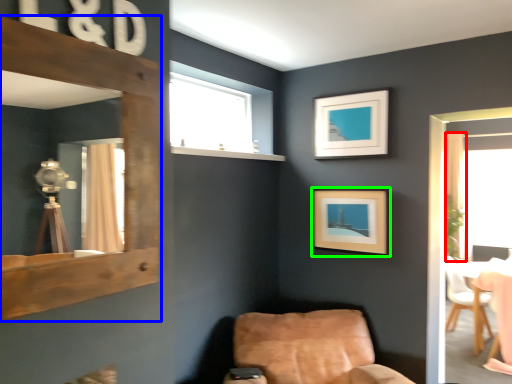
Question: Which object is positioned closest to curtain (highlighted by a red box)? Select from mirror (highlighted by a blue box) and picture frame (highlighted by a green box).

Choices:
 (A) mirror
 (B) picture frame

Answer: (B)